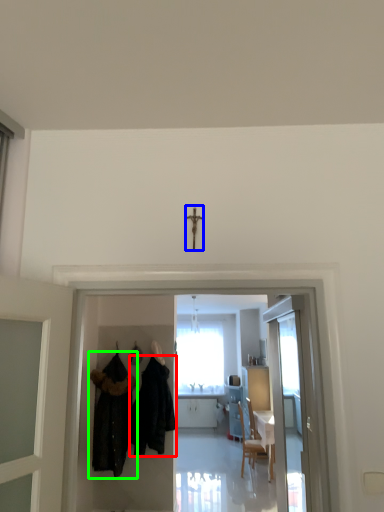
Question: Which object is positioned farthest from fancy dress (highlighted by a red box)? Select from crucifix (highlighted by a blue box) and fancy dress (highlighted by a green box).

Choices:
 (A) crucifix
 (B) fancy dress

Answer: (A)